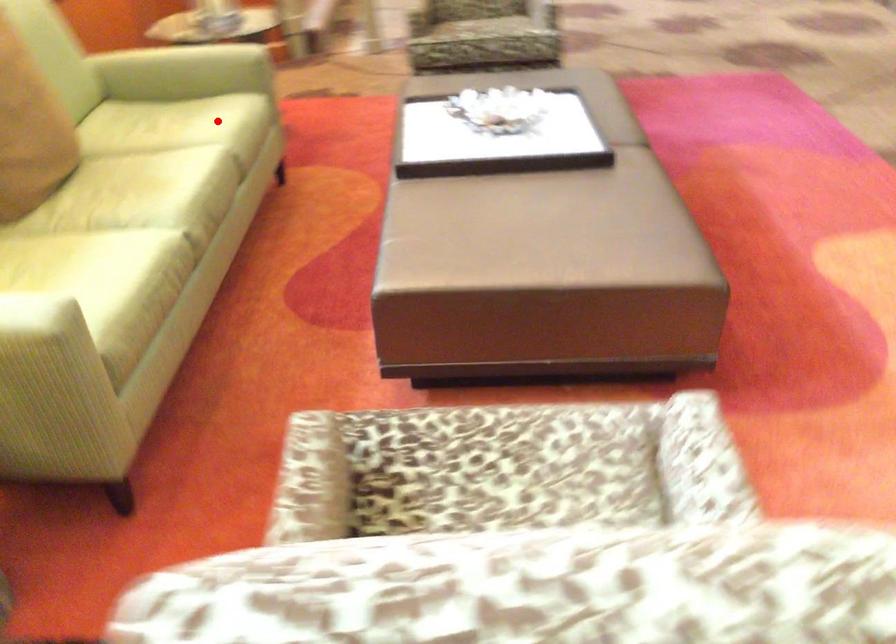
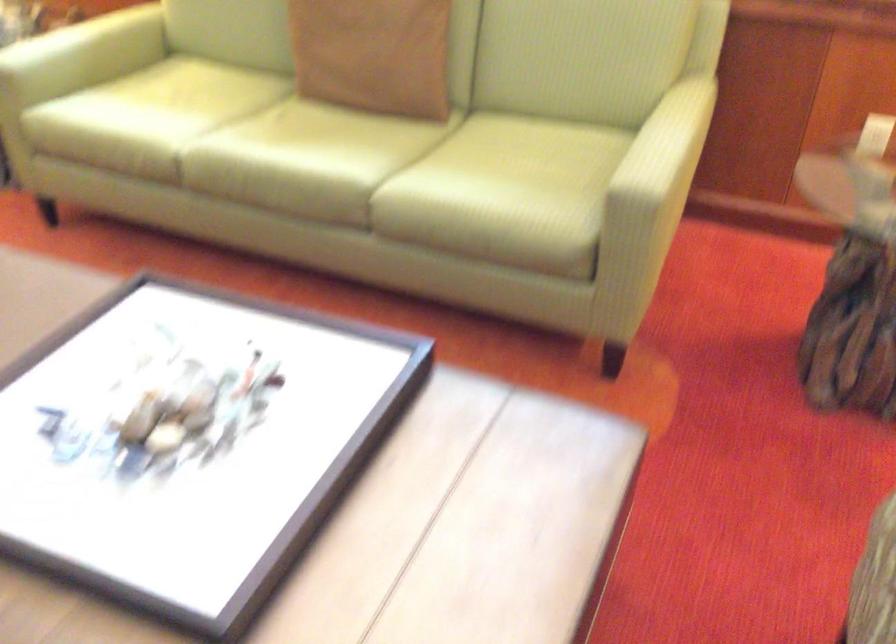
Where in the second image is the point corresponding to the highlighted location from the first image?

(429, 182)